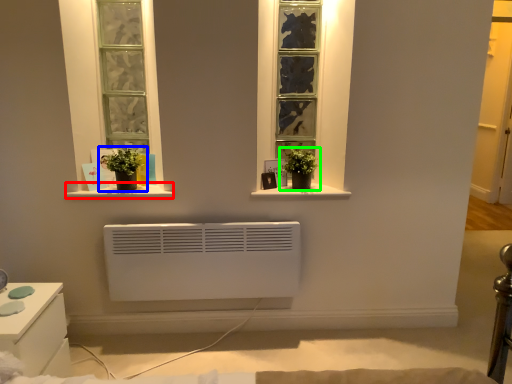
Question: Based on their relative distances, which object is nearer to window sill (highlighted by a red box)? Choose from houseplant (highlighted by a blue box) and houseplant (highlighted by a green box).

Choices:
 (A) houseplant
 (B) houseplant

Answer: (A)